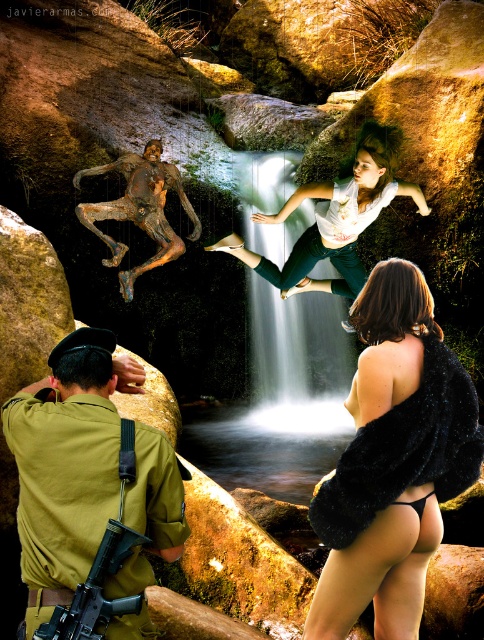
Question: Is black fur coat at lower right thinner than khaki uniform at lower left?

Choices:
 (A) no
 (B) yes

Answer: (A)

Question: Which of the following is the farthest from the observer?

Choices:
 (A) khaki uniform at lower left
 (B) bronze sculpture at center
 (C) black fur coat at lower right

Answer: (B)

Question: Is bronze sculpture at center bigger than matte black rifle at lower left?

Choices:
 (A) yes
 (B) no

Answer: (A)

Question: Is bronze sculpture at center to the right of matte black rifle at lower left from the viewer's perspective?

Choices:
 (A) yes
 (B) no

Answer: (B)

Question: Which object is closer to the camera taking this photo?

Choices:
 (A) bronze sculpture at center
 (B) matte black rifle at lower left
 (C) black fur coat at lower right
 (D) khaki uniform at lower left

Answer: (B)

Question: Which object is positioned farthest from the white matte shirt at upper center?

Choices:
 (A) black fur coat at lower right
 (B) bronze sculpture at center
 (C) khaki uniform at lower left
 (D) matte black rifle at lower left

Answer: (D)